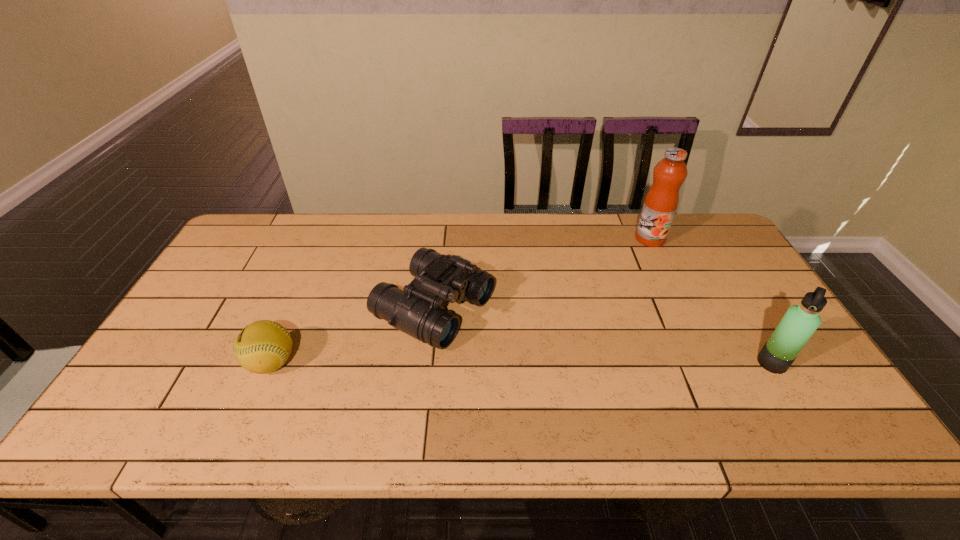
Locate an element on the screen. free spot on the desktop that is between the softball and the rightmost object and is positioned on the front label of the tallest object is located at coordinates (564, 363).

Locate an element on the screen. Image resolution: width=960 pixels, height=540 pixels. free space on the desktop that is between the softball and the rightmost object and is positioned through the lenses of the third tallest object is located at coordinates (550, 363).